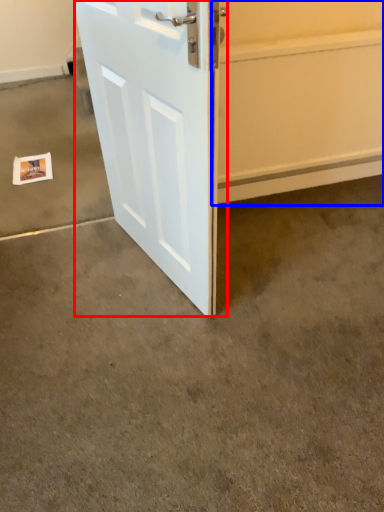
Question: Which object appears farthest to the camera in this image, door (highlighted by a red box) or garage door (highlighted by a blue box)?

Choices:
 (A) door
 (B) garage door

Answer: (B)